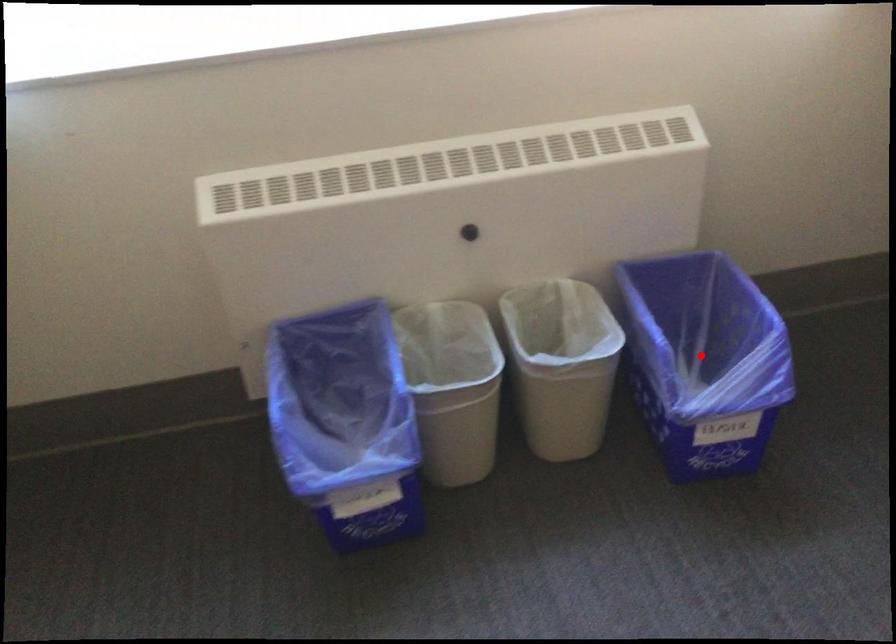
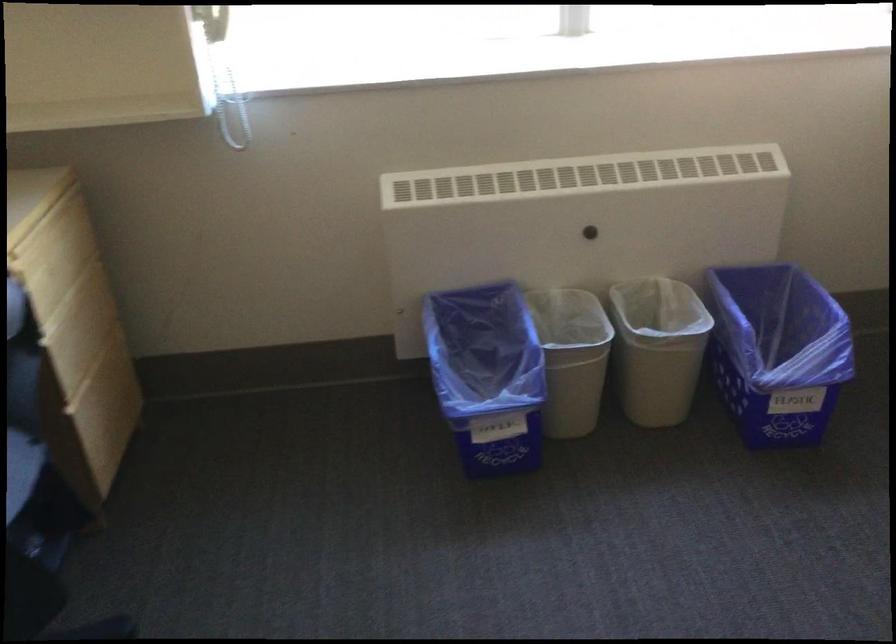
Question: I am providing you with two images of the same scene from different viewpoints. In image1, a red point is highlighted. Considering the same 3D point in image2, which of the following is correct?

Choices:
 (A) It is closer
 (B) It is farther

Answer: (B)